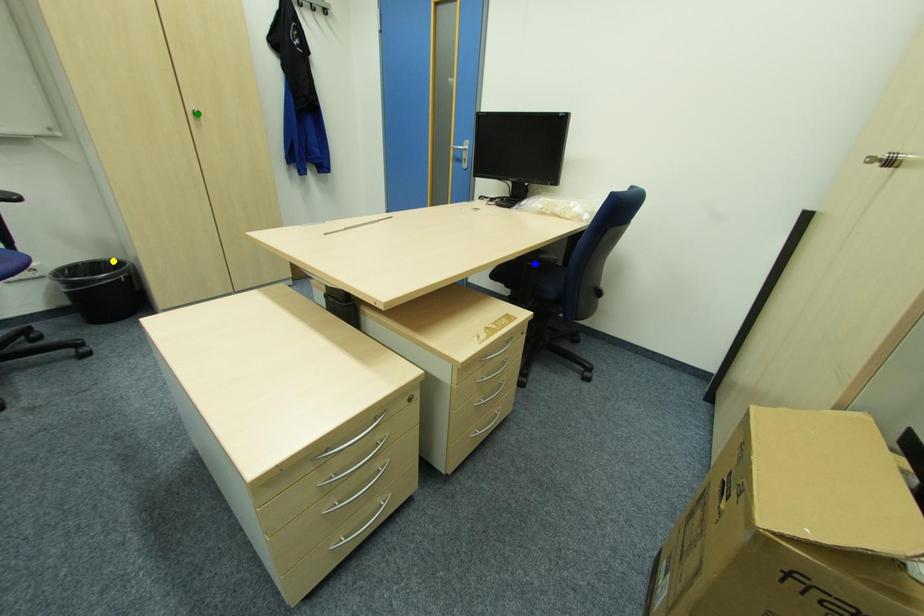
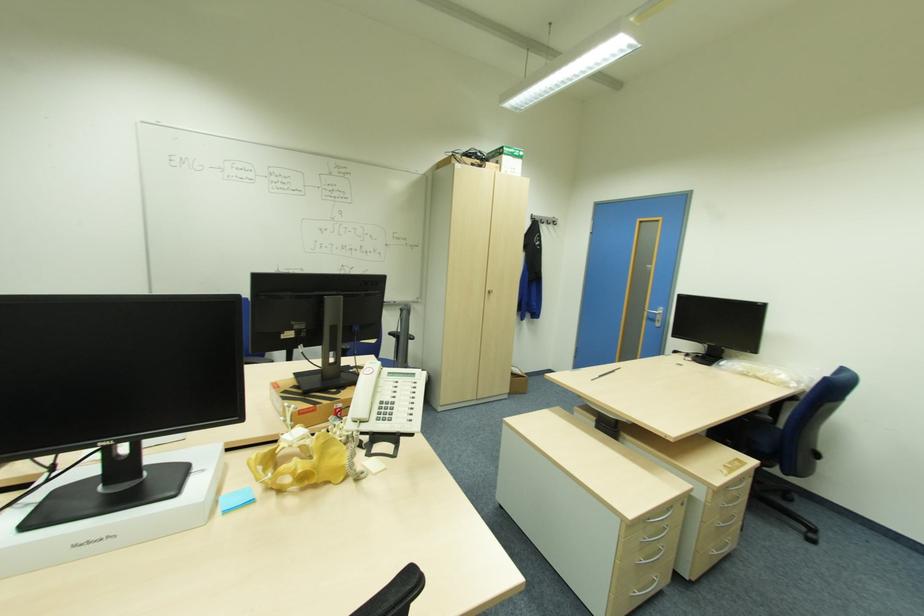
I am providing you with two images of the same scene from different viewpoints. Three points are marked in image1. Which point corresponds to a part or object that is occluded in image2?In image1, three points are marked. Which of them correspond to a part or object that is occluded in image2?Among the three points shown in image1, which one corresponds to a part or object that is no longer visible due to occlusion in image2?

Invisible in image2: yellow point.